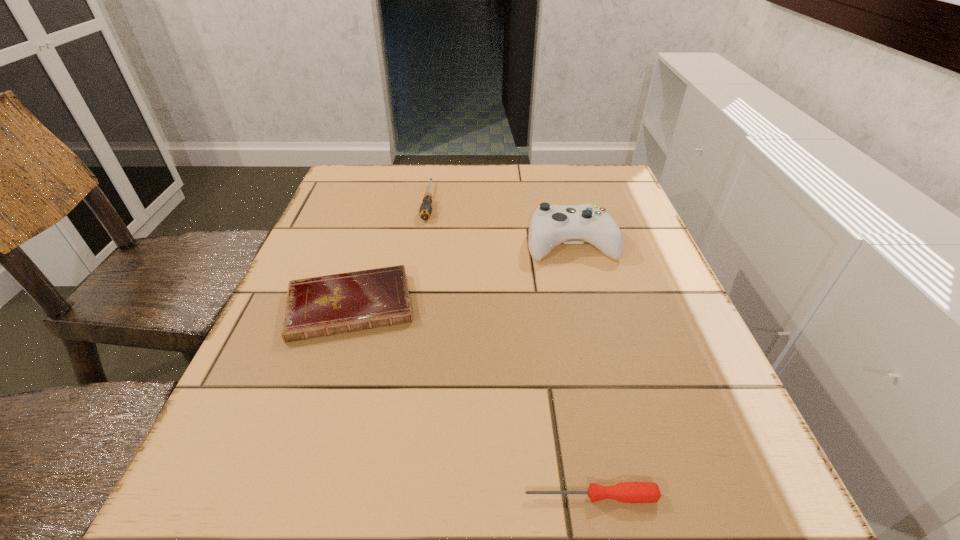
Locate an element on the screen. This screenshot has width=960, height=540. vacant space at the near edge of the desktop is located at coordinates (556, 488).

This screenshot has width=960, height=540. In the image, there is a desktop. What are the coordinates of `vacant space at the left edge` in the screenshot? It's located at (235, 464).

In the image, there is a desktop. In order to click on vacant space at the right edge in this screenshot , I will do coord(687,317).

In the image, there is a desktop. At what (x,y) coordinates should I click in order to perform the action: click on free space at the near left corner. Please return your answer as a coordinate pair (x, y). The height and width of the screenshot is (540, 960). Looking at the image, I should click on (225, 532).

Find the location of a particular element. The height and width of the screenshot is (540, 960). blank space at the far right corner of the desktop is located at coordinates click(x=560, y=164).

Where is `empty space between the tallest object and the taller screwdriver`? The height and width of the screenshot is (540, 960). empty space between the tallest object and the taller screwdriver is located at coordinates (500, 222).

At what (x,y) coordinates should I click in order to perform the action: click on vacant area that lies between the second tallest object and the third farthest object. Please return your answer as a coordinate pair (x, y). The image size is (960, 540). Looking at the image, I should click on (390, 254).

Identify the location of free space between the third shortest object and the control. (500, 222).

Find the location of a particular element. This screenshot has height=540, width=960. vacant point located between the left screwdriver and the right screwdriver is located at coordinates (510, 349).

Where is `vacant point located between the second farthest object and the nearer screwdriver`? The width and height of the screenshot is (960, 540). vacant point located between the second farthest object and the nearer screwdriver is located at coordinates (581, 369).